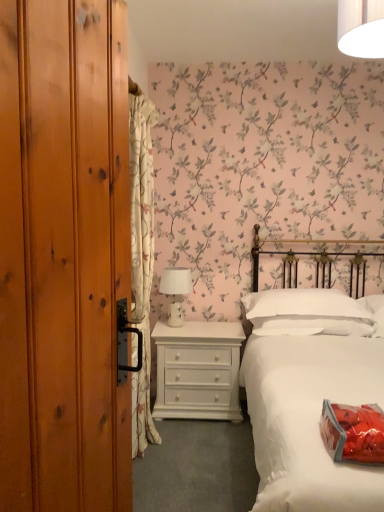
Question: Does white cotton bed at center have a greater height compared to white floral fabric curtain at left?

Choices:
 (A) yes
 (B) no

Answer: (B)

Question: Is white cotton bed at center further to the viewer compared to white floral fabric curtain at left?

Choices:
 (A) no
 (B) yes

Answer: (A)

Question: Would you say white floral fabric curtain at left is part of white cotton bed at center's contents?

Choices:
 (A) no
 (B) yes

Answer: (A)

Question: Is white cotton bed at center in front of white floral fabric curtain at left?

Choices:
 (A) no
 (B) yes

Answer: (B)

Question: From a real-world perspective, is white cotton bed at center positioned under white floral fabric curtain at left based on gravity?

Choices:
 (A) yes
 (B) no

Answer: (A)

Question: Could you tell me if white cotton bed at center is turned towards white floral fabric curtain at left?

Choices:
 (A) no
 (B) yes

Answer: (A)

Question: Is white painted wood chest of drawers at center at the back of white glossy dresser at center?

Choices:
 (A) no
 (B) yes

Answer: (A)

Question: Considering the relative sizes of white glossy dresser at center and white painted wood chest of drawers at center in the image provided, is white glossy dresser at center taller than white painted wood chest of drawers at center?

Choices:
 (A) yes
 (B) no

Answer: (A)

Question: From the image's perspective, is white glossy dresser at center located above white painted wood chest of drawers at center?

Choices:
 (A) yes
 (B) no

Answer: (A)

Question: Would you say white glossy dresser at center contains white painted wood chest of drawers at center?

Choices:
 (A) yes
 (B) no

Answer: (B)

Question: From the image's perspective, is white glossy dresser at center under white painted wood chest of drawers at center?

Choices:
 (A) yes
 (B) no

Answer: (B)

Question: Is white glossy dresser at center smaller than white painted wood chest of drawers at center?

Choices:
 (A) yes
 (B) no

Answer: (A)

Question: From the image's perspective, is white ceramic table lamp at center over white soft pillow at center?

Choices:
 (A) yes
 (B) no

Answer: (A)